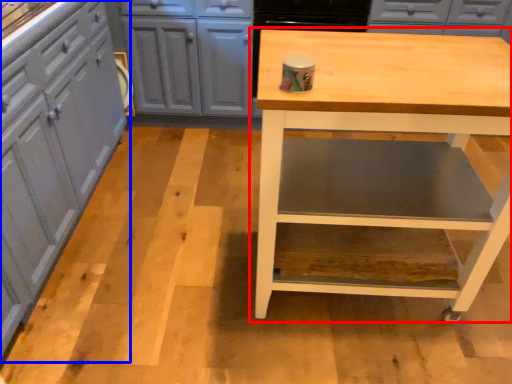
Question: Which of the following is the farthest to the observer, table (highlighted by a red box) or cabinetry (highlighted by a blue box)?

Choices:
 (A) table
 (B) cabinetry

Answer: (A)